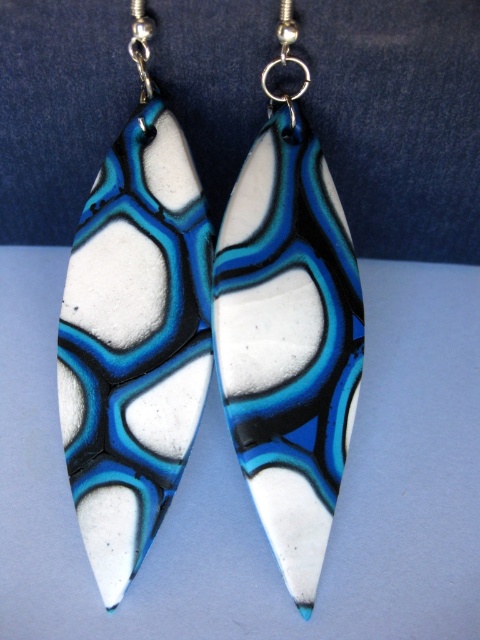
Is point (94, 528) behind point (314, 576)?

Yes, it is.

Does matte polymer clay earring at left have a greater height compared to matte polymer clay earring at center?

No.

The height and width of the screenshot is (640, 480). Find the location of `matte polymer clay earring at left`. matte polymer clay earring at left is located at coordinates (134, 333).